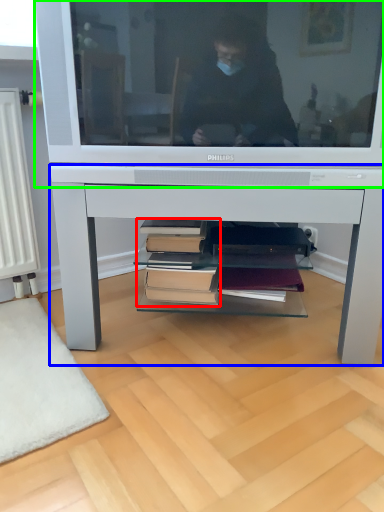
Question: Considering the real-world distances, which object is closest to book (highlighted by a red box)? desk (highlighted by a blue box) or television (highlighted by a green box).

Choices:
 (A) desk
 (B) television

Answer: (A)